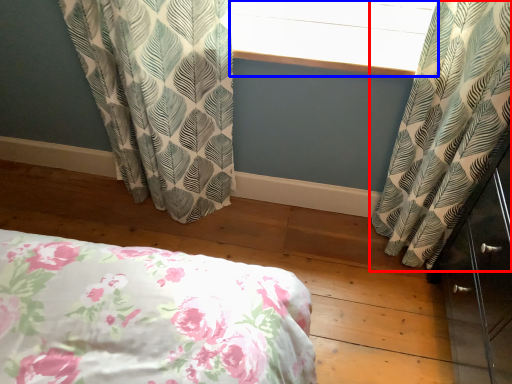
Question: Which object is further to the camera taking this photo, curtain (highlighted by a red box) or window screen (highlighted by a blue box)?

Choices:
 (A) curtain
 (B) window screen

Answer: (B)